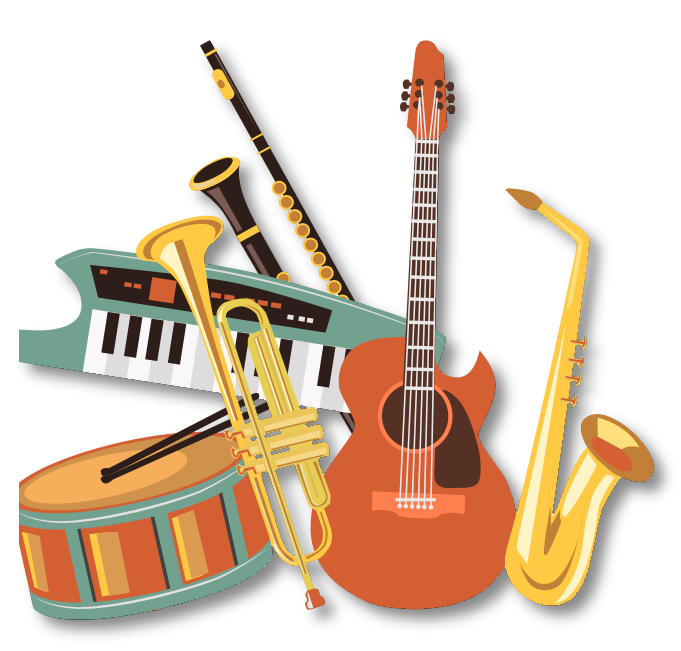
This screenshot has width=681, height=651. I want to click on keys, so click(95, 361), click(112, 368), click(167, 379), click(193, 381), click(306, 392), click(331, 400).